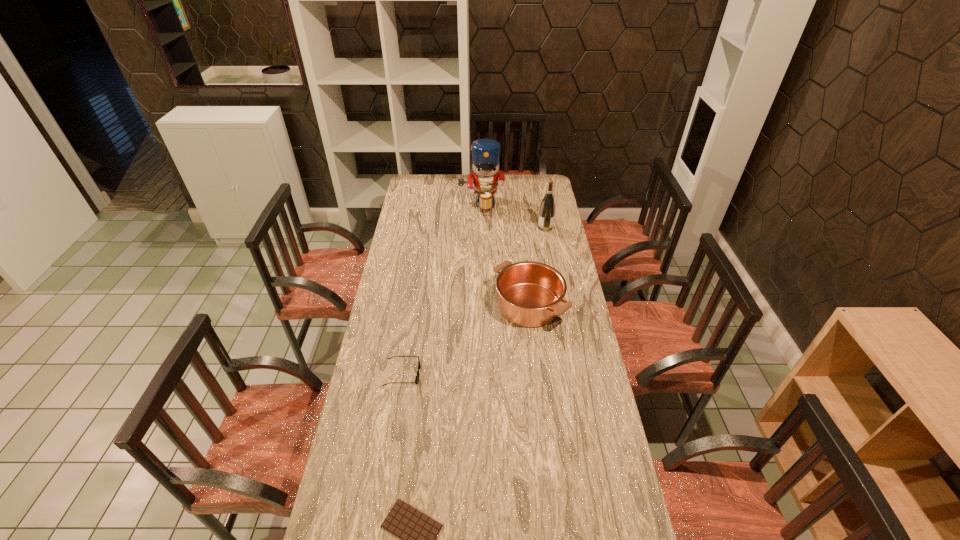
This screenshot has height=540, width=960. I want to click on vacant space located 0.150m on the label of the wine bottle, so click(510, 228).

This screenshot has width=960, height=540. I want to click on vacant position located 0.110m on the label of the wine bottle, so [x=517, y=228].

This screenshot has width=960, height=540. I want to click on free space located 0.050m on the back of the third shortest object, so click(x=525, y=272).

This screenshot has width=960, height=540. What are the coordinates of `vacant space located 0.340m on the front-facing side of the fourth farthest object` in the screenshot? It's located at (511, 374).

Find the location of a particular element. The height and width of the screenshot is (540, 960). object present at the far edge is located at coordinates (485, 153).

Image resolution: width=960 pixels, height=540 pixels. I want to click on object located at the left edge, so click(x=417, y=376).

Where is `wine bottle that is at the right edge`? The width and height of the screenshot is (960, 540). wine bottle that is at the right edge is located at coordinates (547, 208).

This screenshot has width=960, height=540. What are the coordinates of `saucepan at the right edge` in the screenshot? It's located at (x=530, y=294).

Locate an element on the screen. vacant space at the far edge of the desktop is located at coordinates (521, 187).

At what (x,y) coordinates should I click in order to perform the action: click on vacant position at the left edge of the desktop. Please return your answer as a coordinate pair (x, y). Looking at the image, I should click on (372, 529).